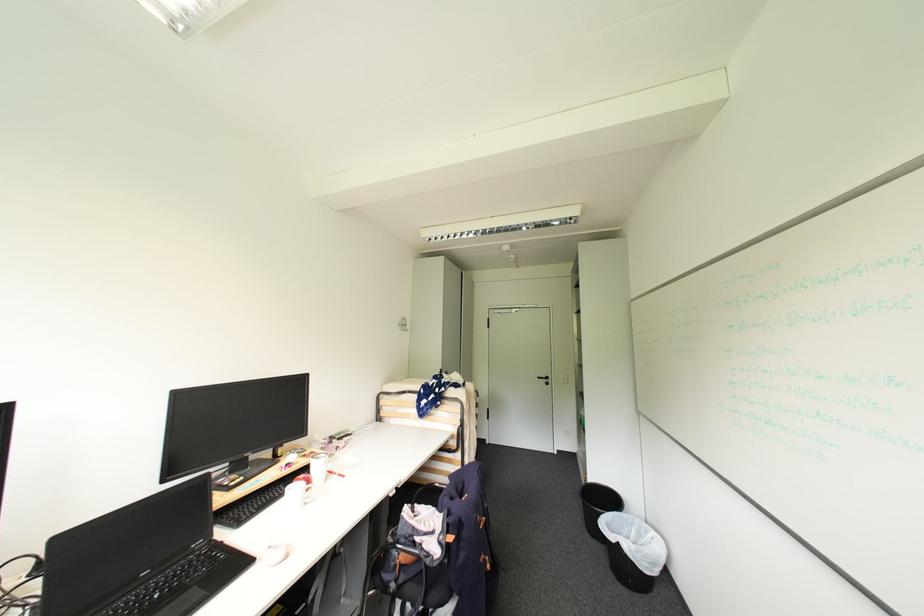
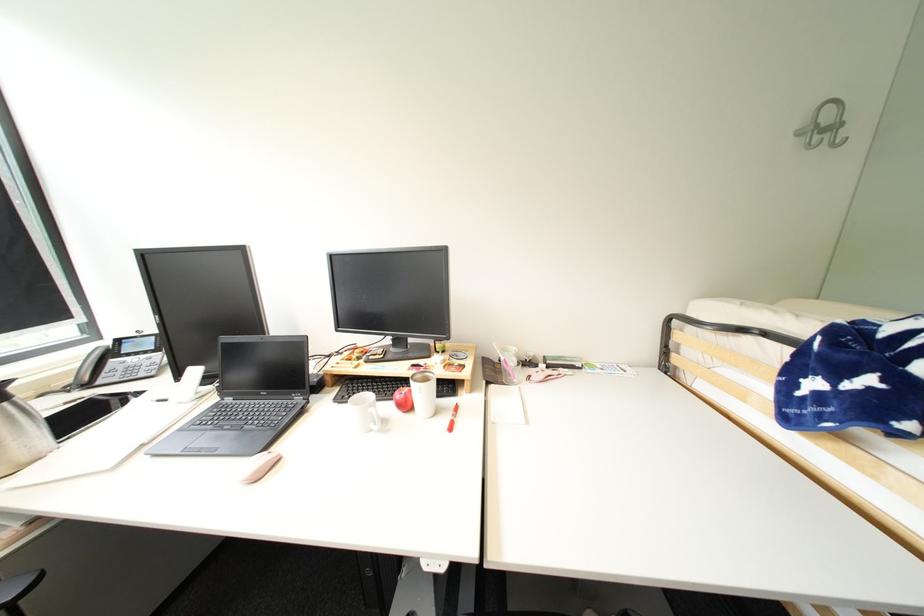
Find the pixel in the second image that matches point 411,326 in the first image.

(841, 128)